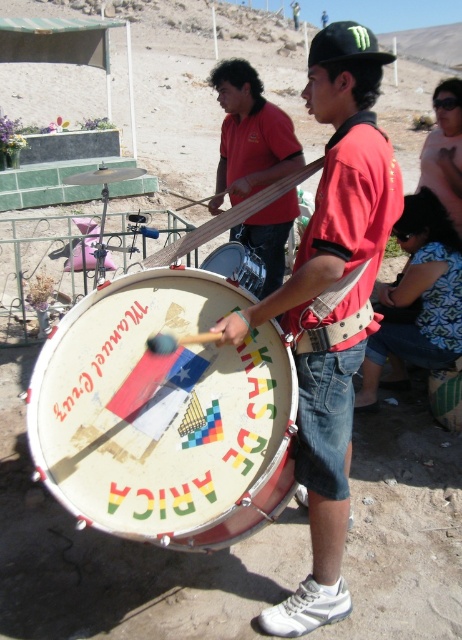
You are a fashion designer observing the image. You need to determine which item is shorter in height between the blue denim shorts at lower right and the black matte baseball cap at upper center. Which one is shorter?

The blue denim shorts at lower right is shorter than the black matte baseball cap at upper center.

You are standing at the center of the desert scene and want to place a small cactus exactly where the blue denim shorts at lower right are located. What coordinates should you use?

The coordinates for the blue denim shorts at lower right are 0.466 on the x axis and 0.907 on the y axis, so you should place the cactus at those coordinates.